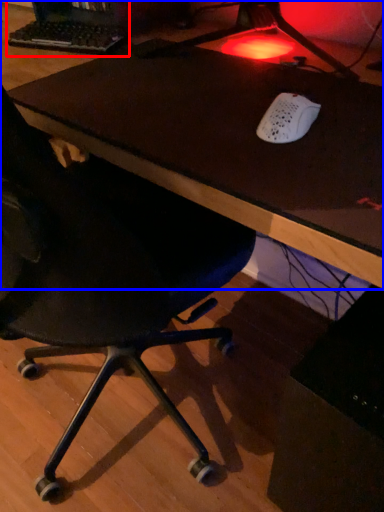
Question: Which point is closer to the camera, desktop computer (highlighted by a red box) or table (highlighted by a blue box)?

Choices:
 (A) desktop computer
 (B) table

Answer: (B)